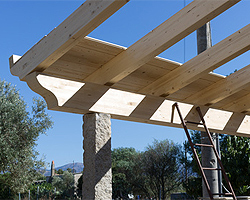
You are a GUI agent. You are given a task and a screenshot of the screen. Output one action in this format:
    pyautogui.click(x=<x>, y=<y>)
    Task: Click on the rightmost beam
    The width and height of the screenshot is (250, 200).
    Given the screenshot: What is the action you would take?
    pos(225,87)